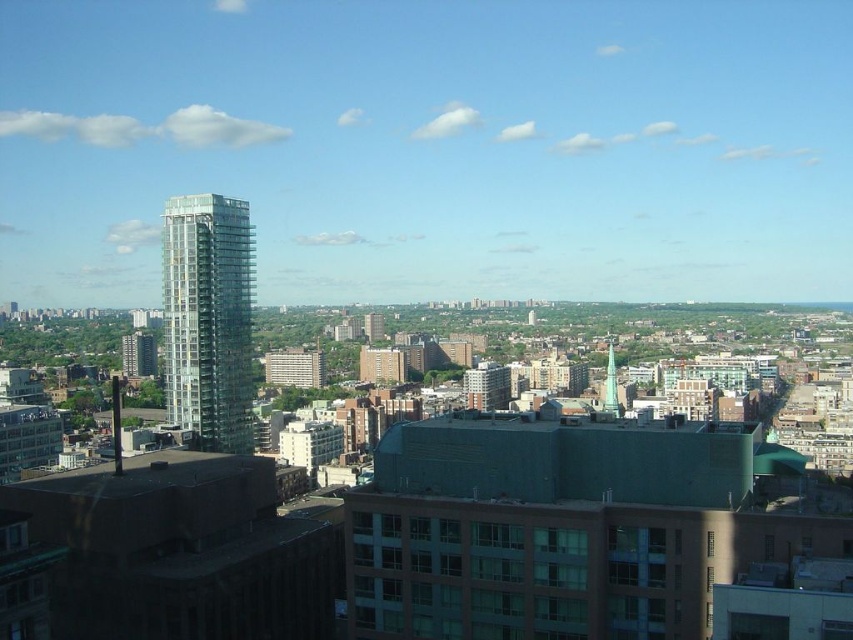
You are an architect analyzing the cityscape and need to determine the relative positions of the transparent glass tower at left and the green glass tower at center. Which tower is located to the left of the other?

The transparent glass tower at left is positioned on the left side of the green glass tower at center.

You are an urban planner reviewing the city layout. You need to determine which of the two towers, the transparent glass tower at left or the green glass tower at center, is more suitable for hosting a large corporate event. Considering their sizes, which tower would you recommend?

The transparent glass tower at left has a larger size compared to the green glass tower at center, so it would be more suitable for hosting a large corporate event due to its greater capacity.